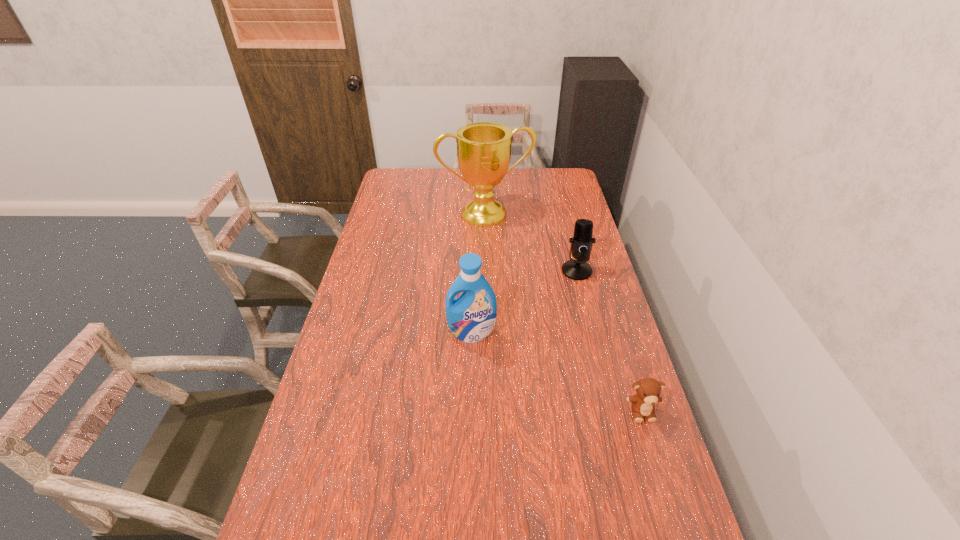
Where is `free space on the desktop that is between the third shortest object and the shortest object and is positioned on the shiny surface of the tallest object`? The image size is (960, 540). free space on the desktop that is between the third shortest object and the shortest object and is positioned on the shiny surface of the tallest object is located at coordinates (559, 373).

Image resolution: width=960 pixels, height=540 pixels. In order to click on vacant space on the desktop that is between the second tallest object and the nearest object and is positioned on the stand of the second shortest object in this screenshot , I will do `click(562, 374)`.